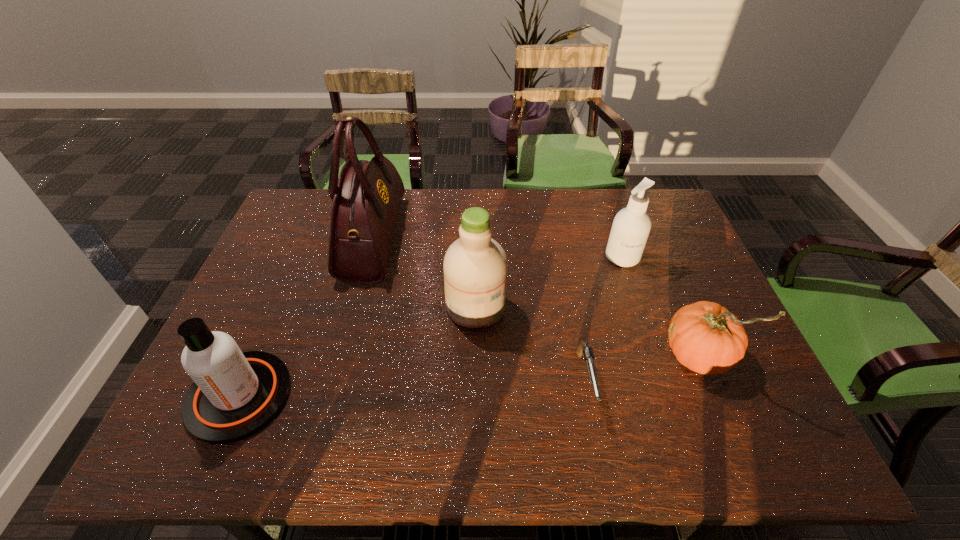
Find the location of a particular element. The height and width of the screenshot is (540, 960). free point located 0.110m on the front-facing side of the tallest object is located at coordinates [434, 238].

Image resolution: width=960 pixels, height=540 pixels. In order to click on blank area located 0.240m on the front label of the second farthest cleansing agent in this screenshot , I will do `click(595, 307)`.

Where is `vacant space located 0.360m on the front label of the rightmost cleansing agent`? This screenshot has height=540, width=960. vacant space located 0.360m on the front label of the rightmost cleansing agent is located at coordinates (662, 375).

I want to click on vacant region located on the left of the pumpkin, so click(x=631, y=353).

Image resolution: width=960 pixels, height=540 pixels. In order to click on vacant space located 0.090m on the right of the leftmost object in this screenshot , I will do `click(329, 396)`.

Image resolution: width=960 pixels, height=540 pixels. In order to click on free location located aiming along the barrel of the shortest object in this screenshot , I will do `click(601, 458)`.

Find the location of a particular element. This screenshot has height=540, width=960. object that is at the far edge is located at coordinates (366, 197).

Where is `object at the near edge`? object at the near edge is located at coordinates (235, 394).

This screenshot has height=540, width=960. What are the coordinates of `object located at the left edge` in the screenshot? It's located at (235, 394).

Image resolution: width=960 pixels, height=540 pixels. Identify the location of object that is at the right edge. (705, 337).